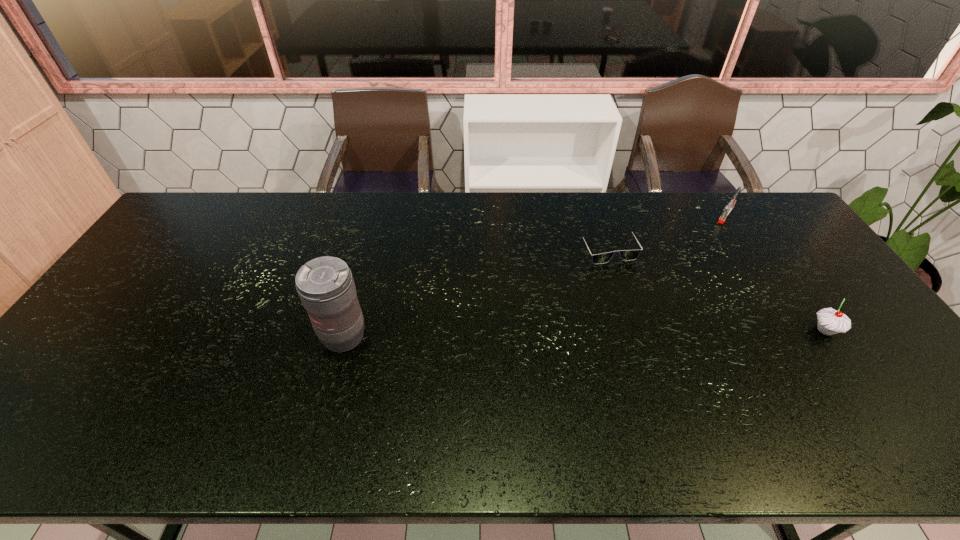
Find the location of a particular element. The image size is (960, 540). the leftmost object is located at coordinates (325, 285).

I want to click on telephoto lens, so click(325, 285).

The width and height of the screenshot is (960, 540). I want to click on the second tallest object, so click(830, 321).

The width and height of the screenshot is (960, 540). Find the location of `the third tallest object`. the third tallest object is located at coordinates (729, 207).

Find the location of a particular element. The width and height of the screenshot is (960, 540). stapler is located at coordinates (729, 207).

At what (x,y) coordinates should I click in order to perform the action: click on the third object from right to left. Please return your answer as a coordinate pair (x, y). The image size is (960, 540). Looking at the image, I should click on (626, 255).

Find the location of a particular element. the second farthest object is located at coordinates (626, 255).

I want to click on vacant space located on the side of the leftmost object where the control switches are located, so click(333, 377).

What are the coordinates of `free region located on the front of the cupcake` in the screenshot? It's located at (858, 378).

The width and height of the screenshot is (960, 540). Identify the location of vacant space located 0.080m on the handle side of the third tallest object. (714, 233).